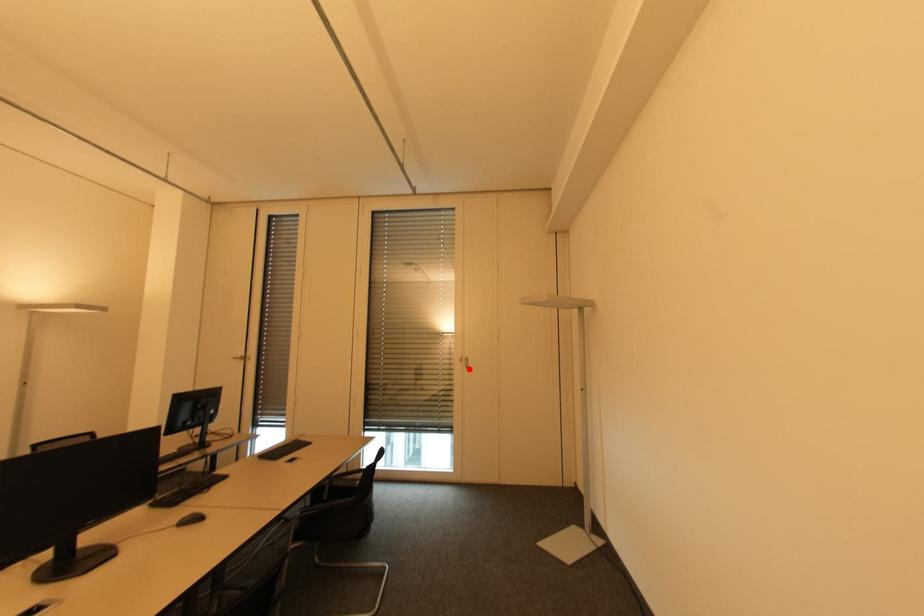
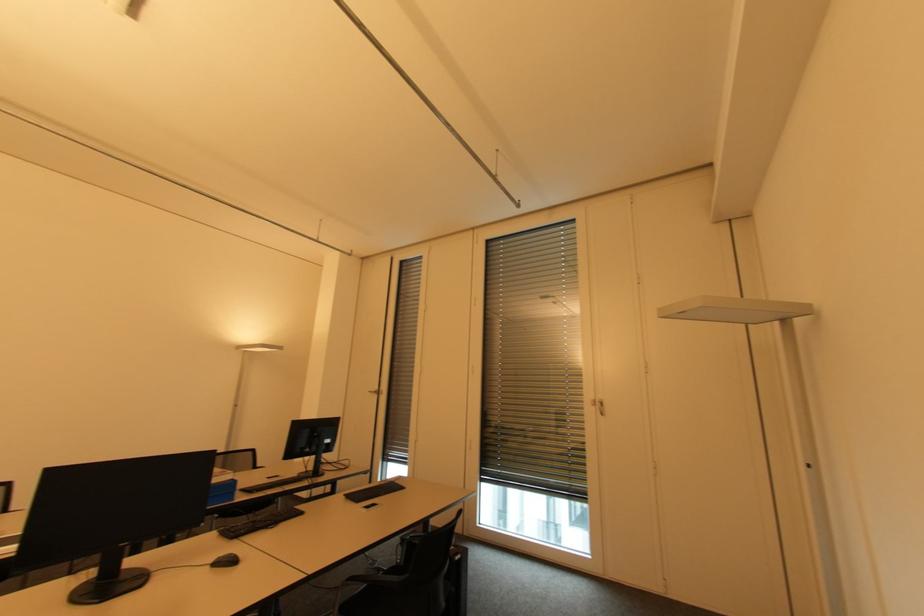
In the second image, find the point that corresponds to the highlighted location in the first image.

(603, 416)